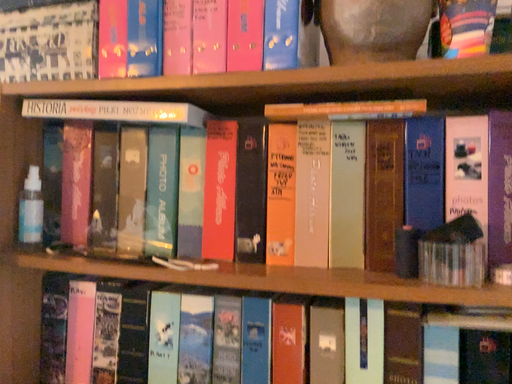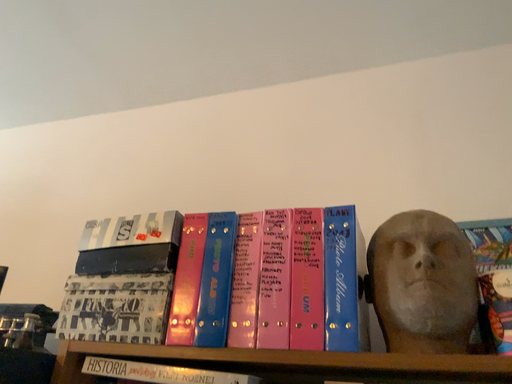
Question: Which way did the camera rotate in the video?

Choices:
 (A) rotated downward
 (B) rotated upward

Answer: (B)